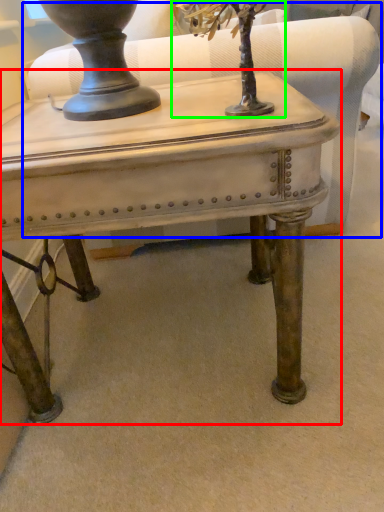
Question: Considering the real-world distances, which object is farthest from table (highlighted by a red box)? swivel chair (highlighted by a blue box) or tree (highlighted by a green box)?

Choices:
 (A) swivel chair
 (B) tree

Answer: (A)